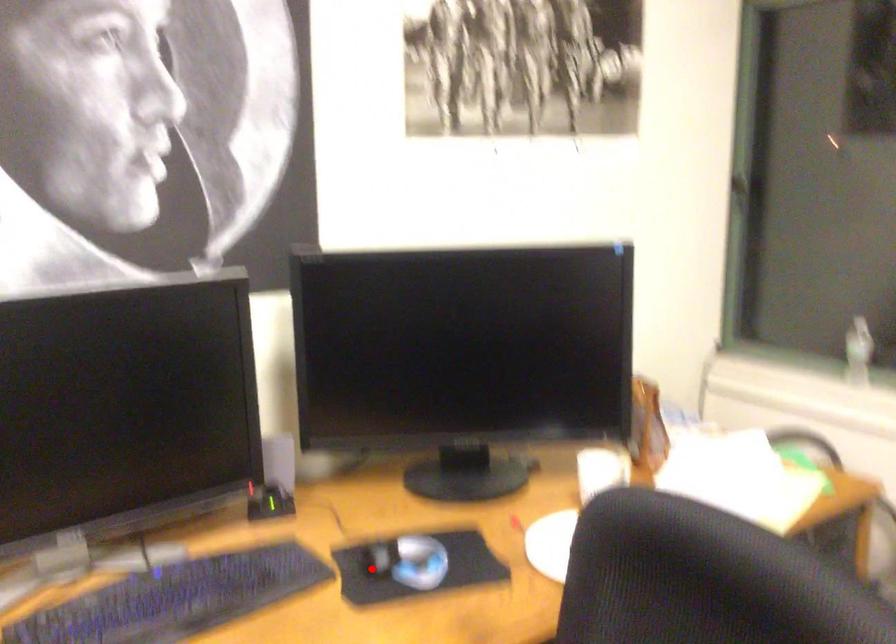
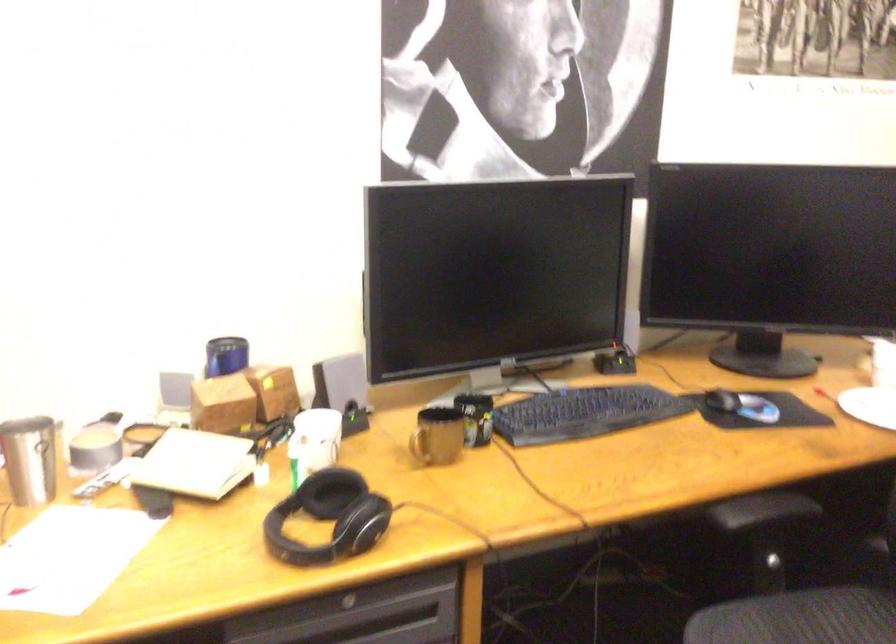
Question: A red point is marked in image1. In image2, is the corresponding 3D point closer to the camera or farther? Reply with the corresponding letter.

Choices:
 (A) The corresponding 3D point is closer.
 (B) The corresponding 3D point is farther.

Answer: (B)